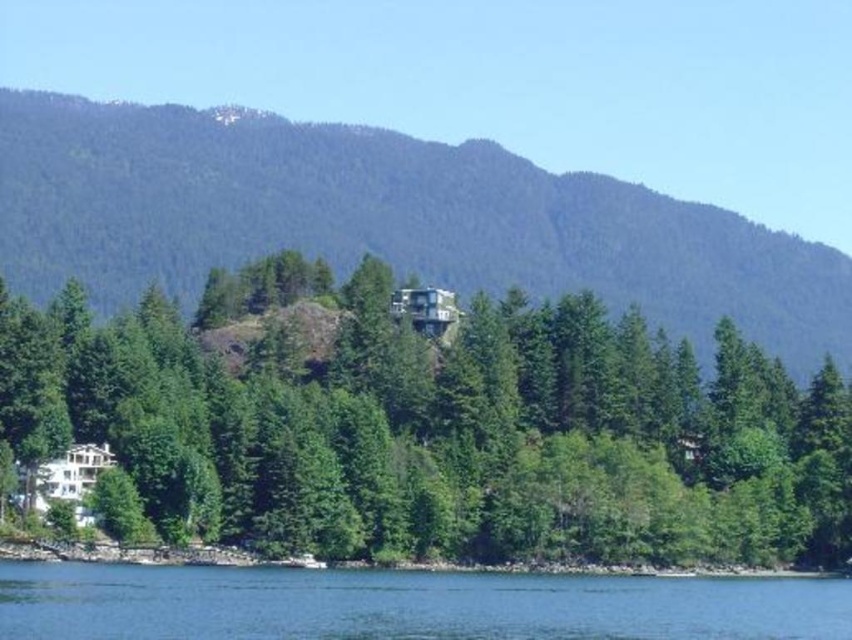
Question: Among these objects, which one is farthest from the camera?

Choices:
 (A) green matte tree at center
 (B) green forested mountain at center

Answer: (B)

Question: Can you confirm if green forested mountain at center is positioned below blue water at lower center?

Choices:
 (A) no
 (B) yes

Answer: (A)

Question: Which is farther from the blue water at lower center?

Choices:
 (A) green matte tree at center
 (B) green forested mountain at center

Answer: (B)

Question: In this image, where is green forested mountain at center located relative to blue water at lower center?

Choices:
 (A) below
 (B) above

Answer: (B)

Question: Is green matte tree at center positioned in front of green forested mountain at center?

Choices:
 (A) no
 (B) yes

Answer: (B)

Question: Among these objects, which one is nearest to the camera?

Choices:
 (A) blue water at lower center
 (B) green forested mountain at center

Answer: (A)